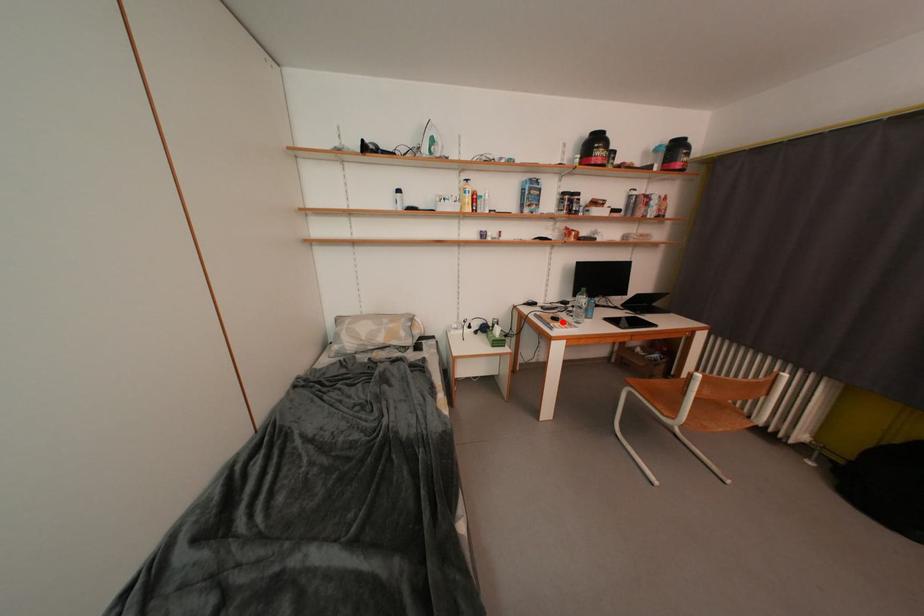
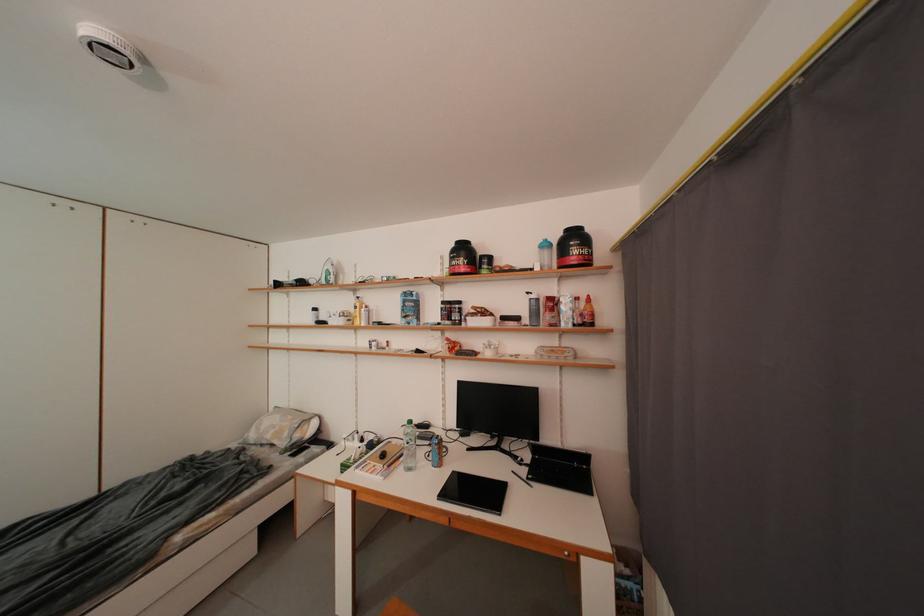
Question: A red point is marked in image1. In image2, is the corresponding 3D point closer to the camera or farther? Reply with the corresponding letter.

Choices:
 (A) The corresponding 3D point is closer.
 (B) The corresponding 3D point is farther.

Answer: (B)